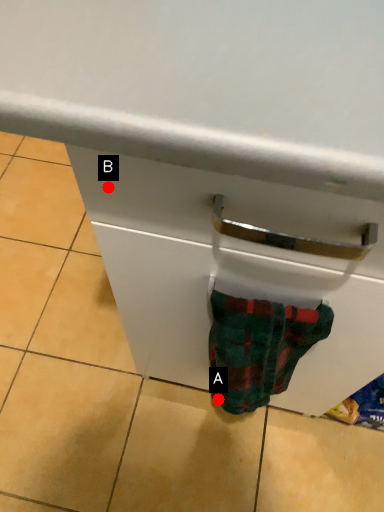
Question: Two points are circled on the image, labeled by A and B beside each circle. Which point is farther to the camera?

Choices:
 (A) A is further
 (B) B is further

Answer: (A)